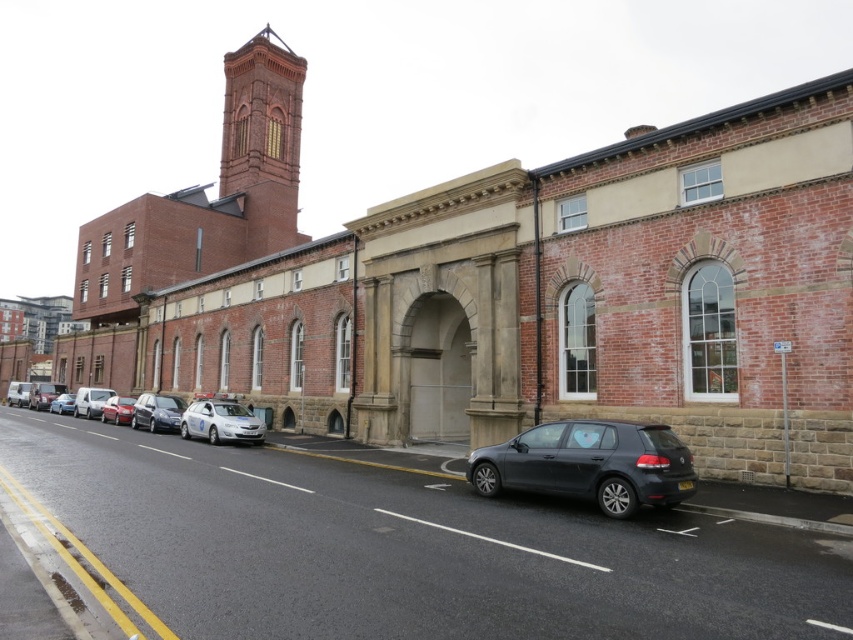
Question: Which of the following is the closest to the observer?

Choices:
 (A) silver metallic sedan at center
 (B) matte silver van at left
 (C) matte gray hatchback at lower center
 (D) silver metallic car at center-left

Answer: (C)

Question: Can you confirm if shiny silver sedan at center-left is positioned below matte silver car at left?

Choices:
 (A) yes
 (B) no

Answer: (B)

Question: Which is nearer to the matte silver car at left?

Choices:
 (A) matte silver van at left
 (B) silver metallic hatchback at center

Answer: (A)

Question: Which is farther from the matte gray hatchback at lower center?

Choices:
 (A) matte silver car at left
 (B) matte silver van at left
 (C) shiny silver sedan at center-left

Answer: (A)

Question: Does shiny silver sedan at center-left have a smaller size compared to matte silver car at left?

Choices:
 (A) no
 (B) yes

Answer: (A)

Question: Does shiny silver sedan at center-left have a larger size compared to matte silver car at left?

Choices:
 (A) no
 (B) yes

Answer: (B)